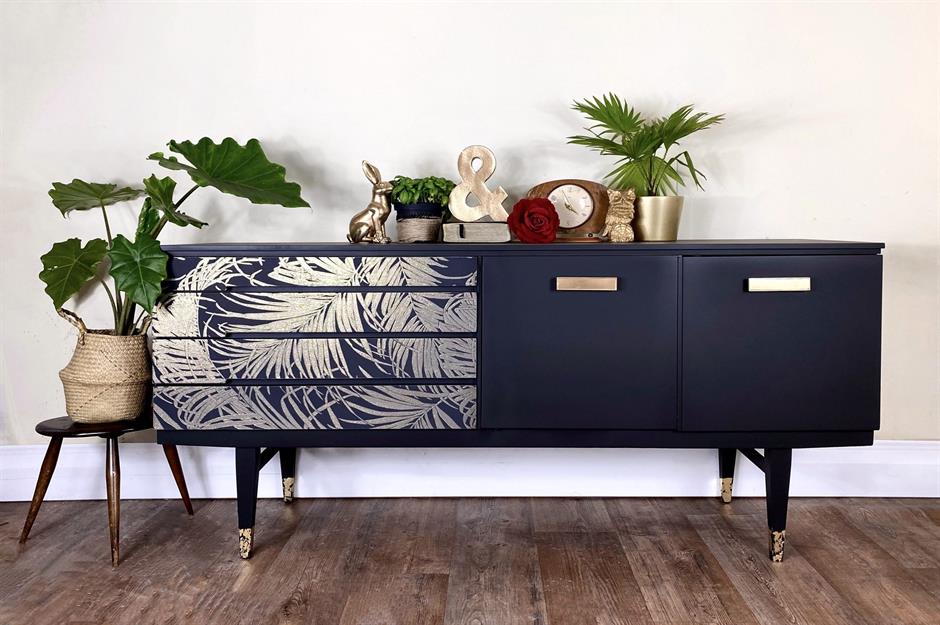
Where is `cabinet doors`? This screenshot has width=940, height=625. cabinet doors is located at coordinates 640,322.